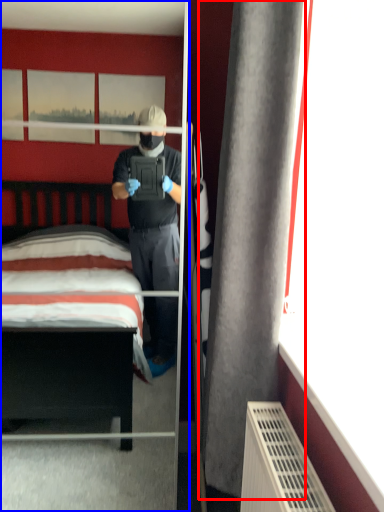
Question: Which point is further to the camera, curtain (highlighted by a red box) or mirror (highlighted by a blue box)?

Choices:
 (A) curtain
 (B) mirror

Answer: (B)